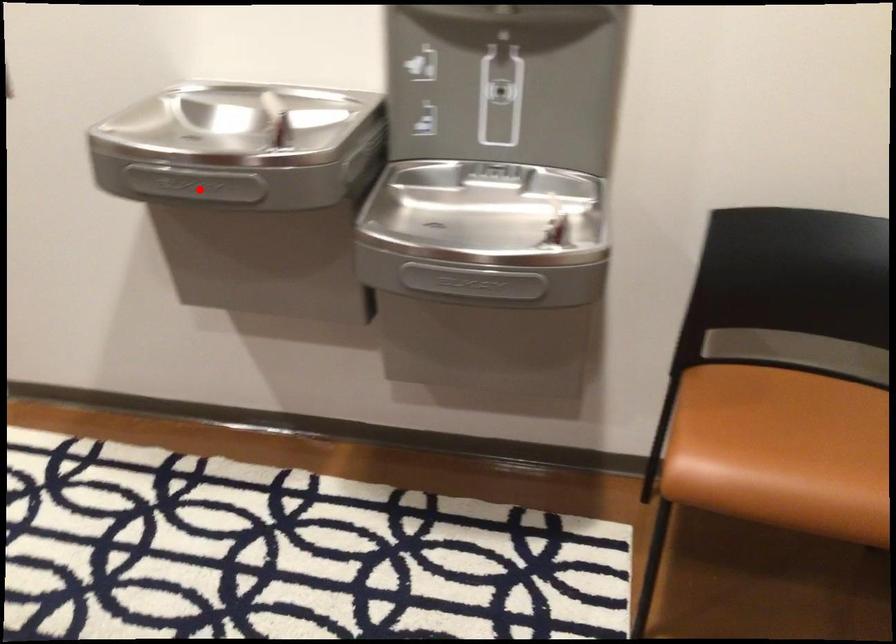
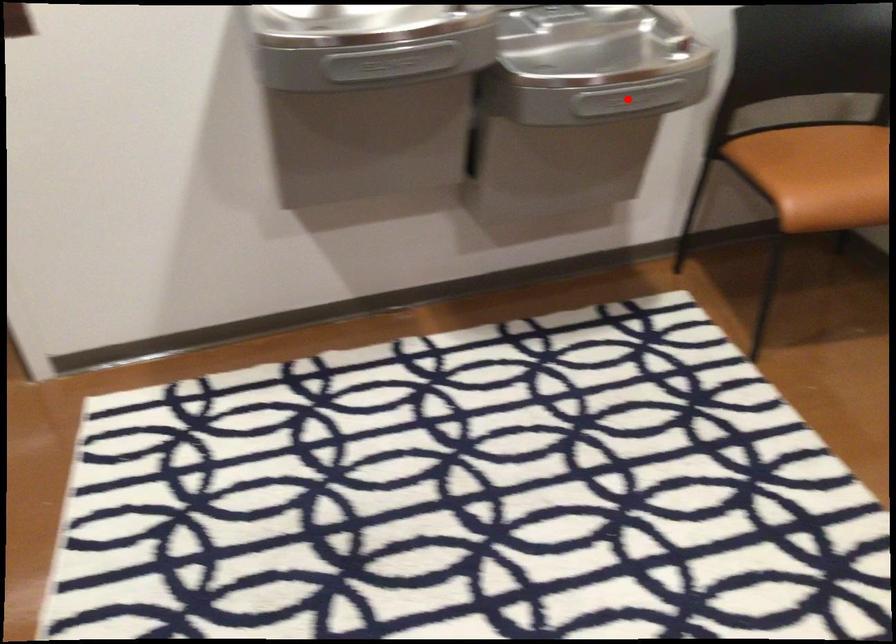
I am providing you with two images of the same scene from different viewpoints. A red point is marked on the first image and another point is marked on the second image. Are the points marked in image1 and image2 representing the same 3D position?

No